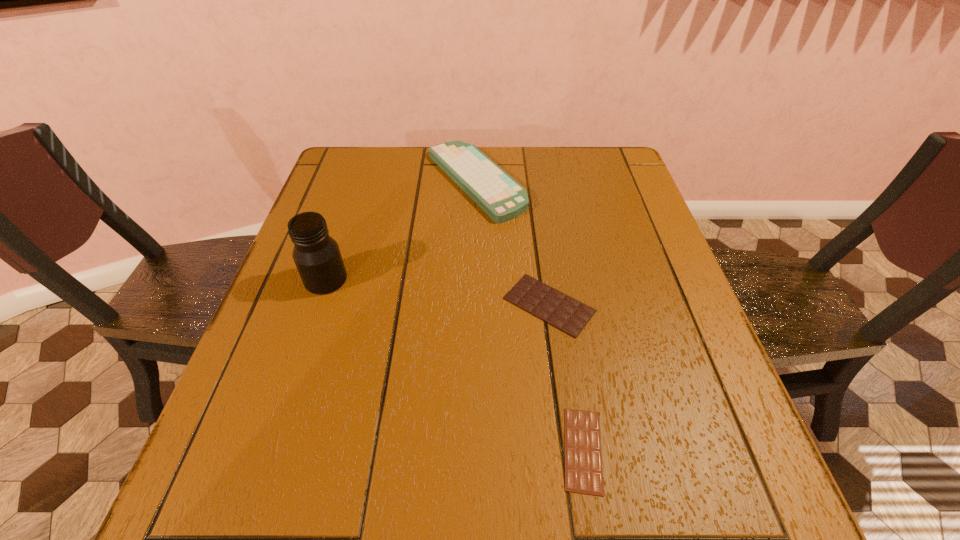
Identify the location of vacant area that lies between the computer keyboard and the leftmost object. (400, 231).

This screenshot has width=960, height=540. What are the coordinates of `object that is the third closest to the second tallest object` in the screenshot? It's located at (583, 460).

Locate an element on the screen. The width and height of the screenshot is (960, 540). the third closest object to the second tallest object is located at coordinates (583, 460).

The height and width of the screenshot is (540, 960). In order to click on free spot that satisfies the following two spatial constraints: 1. on the front side of the nearer chocolate bar; 2. on the right side of the leftmost object in this screenshot , I will do `click(269, 450)`.

Locate an element on the screen. free region that satisfies the following two spatial constraints: 1. on the front side of the leftmost object; 2. on the left side of the nearer chocolate bar is located at coordinates (269, 450).